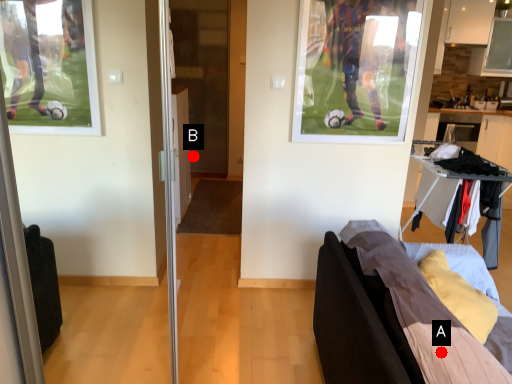
Question: Two points are circled on the image, labeled by A and B beside each circle. Which point appears farthest from the camera in this image?

Choices:
 (A) A is further
 (B) B is further

Answer: (B)